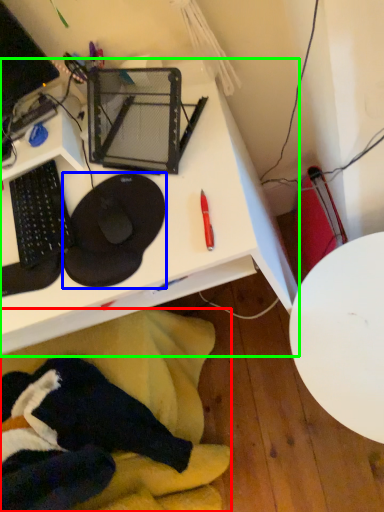
Question: Estimate the real-world distances between objects in this image. Which object is farther from swivel chair (highlighted by a red box), sit (highlighted by a blue box) or desk (highlighted by a green box)?

Choices:
 (A) sit
 (B) desk

Answer: (A)